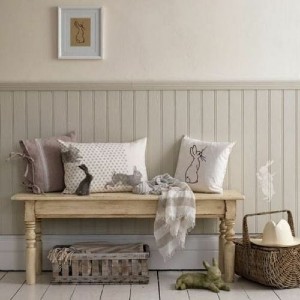
Image resolution: width=300 pixels, height=300 pixels. In order to click on bunny statue in this screenshot , I will do `click(214, 282)`.